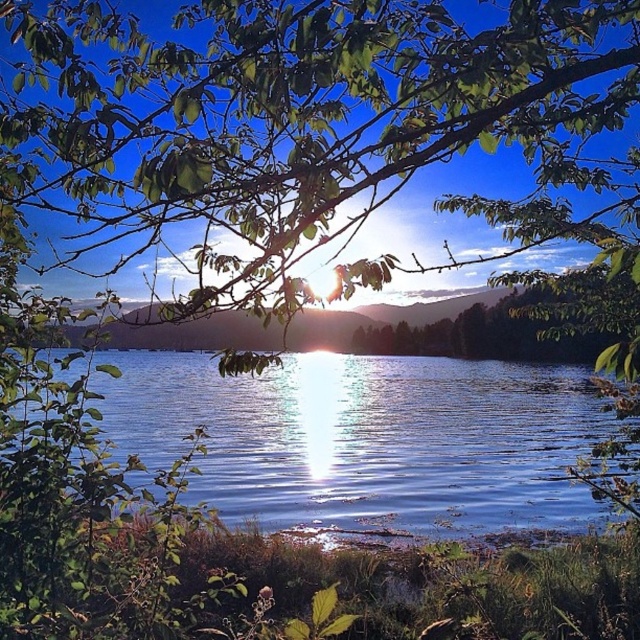
You are an artist wanting to paint the scene. You notice the green leafy branches at upper center. How far apart are they?

The green leafy branches at upper center are 8.99 feet apart.

You are an artist setting up your easel to paint the lakeside scene. You want to focus on capturing the contrast between the green leafy branches at upper center and the glistening blue water at center. Which element should you make wider in your painting to stay true to the scene?

The green leafy branches at upper center should be made wider in the painting since their width is larger than the glistening blue water at center according to the scene description.

You are standing at the lakeside and want to place a small wooden bench between the green leafy branches at upper center and the glistening blue water at center. If the bench is 2 meters long, will it fit in the space between them?

The distance between the green leafy branches at upper center and the glistening blue water at center is 5.44 meters. Since the bench is only 2 meters long, it will fit comfortably within the space between them.